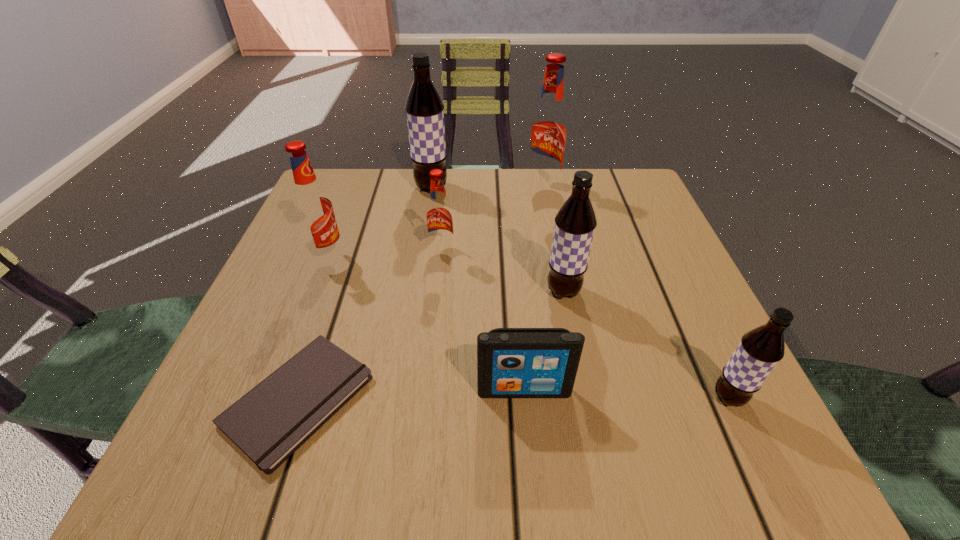
Identify the location of the rightmost object. The width and height of the screenshot is (960, 540). (759, 351).

Identify the location of the seventh tallest object. (511, 362).

Identify the location of checkbook. (269, 423).

Find the location of `free point located 0.160m on the front of the biggest brown root beer`. free point located 0.160m on the front of the biggest brown root beer is located at coordinates (423, 239).

Where is `vacant space located 0.160m on the right of the biggest red root beer`? vacant space located 0.160m on the right of the biggest red root beer is located at coordinates (626, 187).

This screenshot has width=960, height=540. In order to click on free space located 0.050m on the back of the second farthest brown root beer in this screenshot , I will do `click(558, 261)`.

I want to click on free space located on the back of the leftmost root beer, so click(x=347, y=207).

Where is `vacant point located 0.340m on the front of the second red root beer from right to left`? vacant point located 0.340m on the front of the second red root beer from right to left is located at coordinates (426, 416).

The image size is (960, 540). What are the coordinates of `vacant space located 0.240m on the left of the smallest brown root beer` in the screenshot? It's located at click(547, 397).

This screenshot has height=540, width=960. In order to click on free space located 0.050m on the front screen of the iPod in this screenshot , I will do `click(528, 431)`.